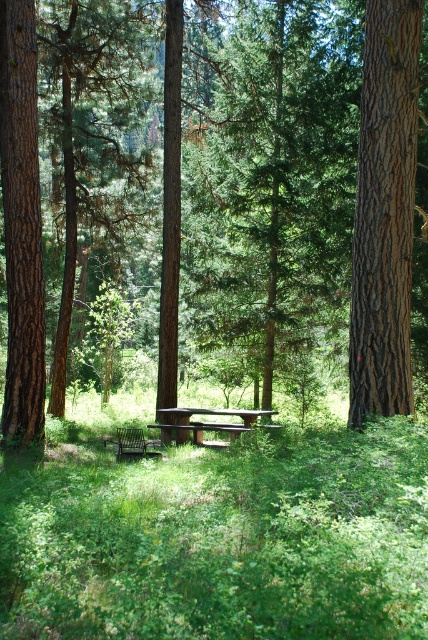
Question: Among these objects, which one is farthest from the camera?

Choices:
 (A) smooth brown tree trunk at left
 (B) smooth brown tree trunk at right

Answer: (A)

Question: Can you confirm if green leafy grass at center is positioned below smooth brown tree trunk at left?

Choices:
 (A) no
 (B) yes

Answer: (B)

Question: Does green textured tree at center appear over green wooden bench at center?

Choices:
 (A) yes
 (B) no

Answer: (A)

Question: Which of the following is the farthest from the observer?

Choices:
 (A) (374, 346)
 (B) (35, 81)

Answer: (B)

Question: Where is green leafy grass at center located in relation to smooth brown tree trunk at left in the image?

Choices:
 (A) left
 (B) right

Answer: (B)

Question: Estimate the real-world distances between objects in this image. Which object is closer to the brown rough tree at center?

Choices:
 (A) green textured tree at center
 (B) green leafy grass at center

Answer: (A)